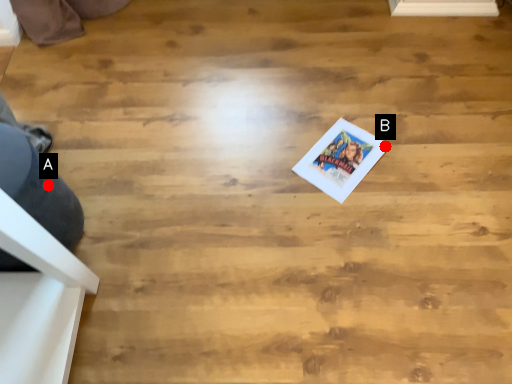
Question: Two points are circled on the image, labeled by A and B beside each circle. Which point is closer to the camera?

Choices:
 (A) A is closer
 (B) B is closer

Answer: (A)